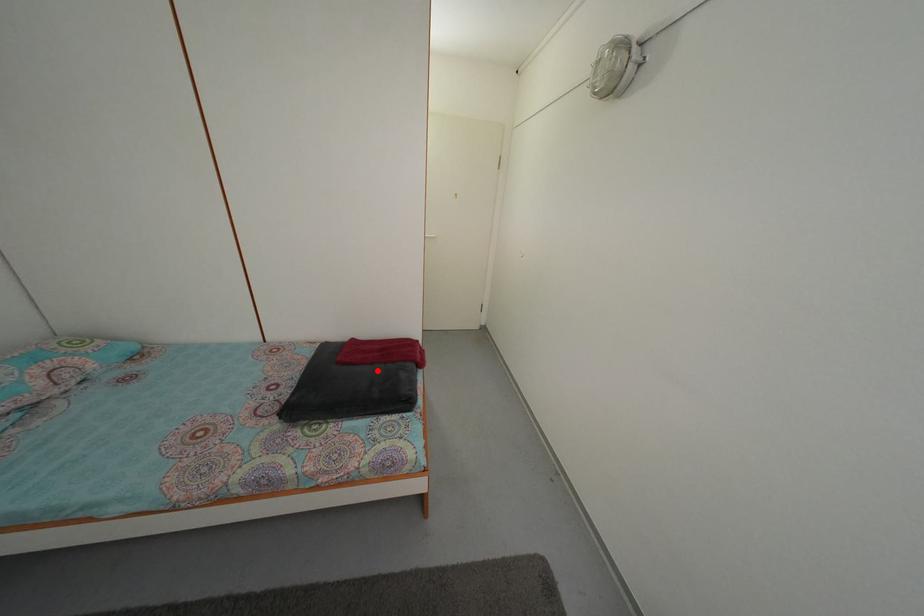
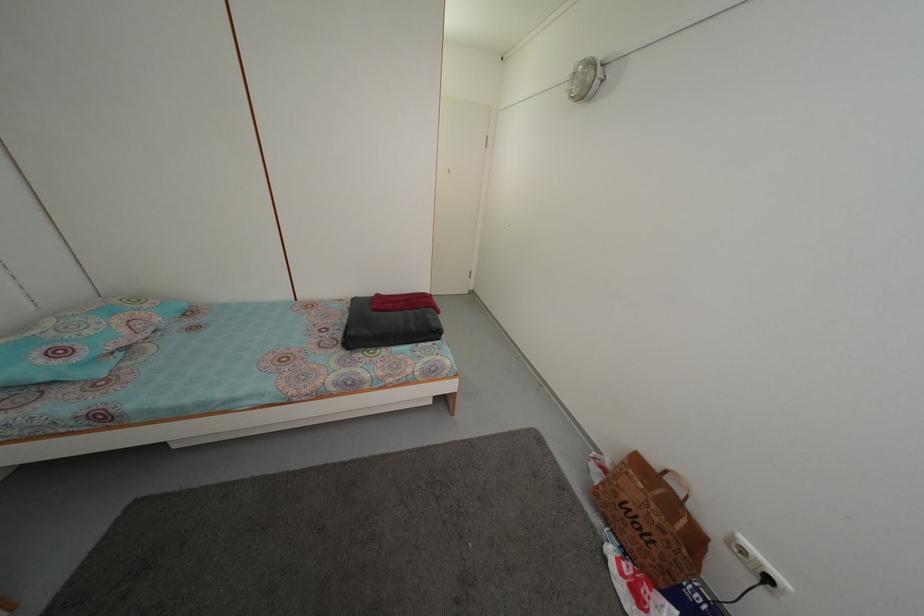
Find the pixel in the second image that matches the highlighted location in the first image.

(407, 317)